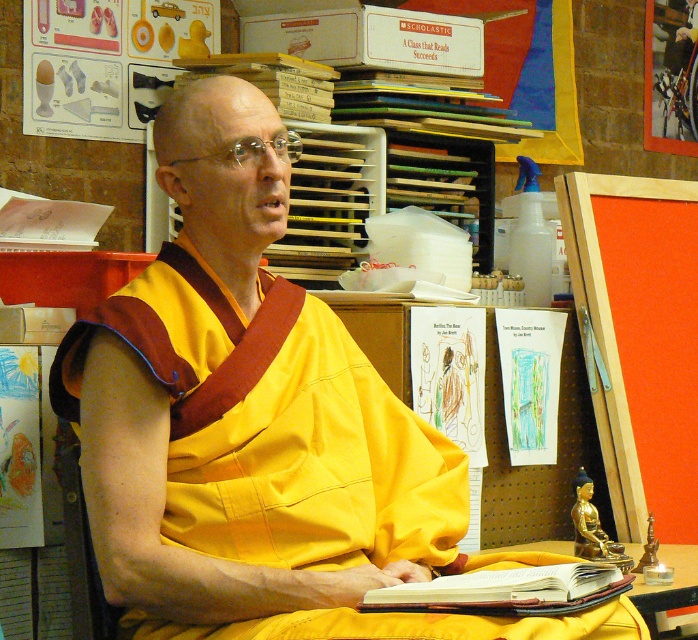
You are standing in the room and want to reach the leather bound book at center. You see a point marked at (505, 592). Is that the location of the leather bound book at center?

Yes, the point at (505, 592) corresponds to the leather bound book at center.

You are standing in the room and want to reach both points, point (586, 602) and point (646, 620). Which point is closer to you?

Point (586, 602) is closer to you because it is in front of point (646, 620).